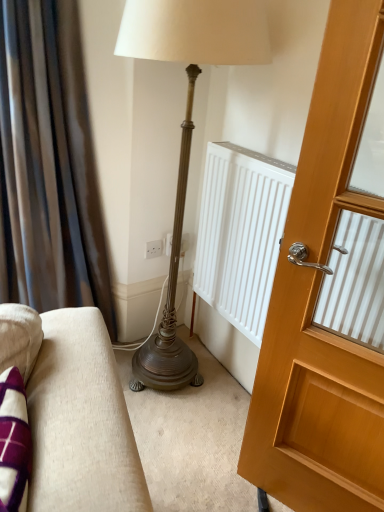
Question: Does wooden door at right turn towards brown velvet curtain at left?

Choices:
 (A) no
 (B) yes

Answer: (A)

Question: From the image's perspective, is wooden door at right under brown velvet curtain at left?

Choices:
 (A) yes
 (B) no

Answer: (A)

Question: Is wooden door at right oriented away from brown velvet curtain at left?

Choices:
 (A) yes
 (B) no

Answer: (B)

Question: Is wooden door at right positioned before brown velvet curtain at left?

Choices:
 (A) yes
 (B) no

Answer: (A)

Question: From a real-world perspective, is wooden door at right physically below brown velvet curtain at left?

Choices:
 (A) yes
 (B) no

Answer: (A)

Question: Can you confirm if wooden door at right is bigger than brown velvet curtain at left?

Choices:
 (A) yes
 (B) no

Answer: (B)

Question: Does brown velvet curtain at left come behind wooden door at right?

Choices:
 (A) no
 (B) yes

Answer: (B)

Question: Is brown velvet curtain at left in front of wooden door at right?

Choices:
 (A) yes
 (B) no

Answer: (B)

Question: Is wooden door at right surrounded by brown velvet curtain at left?

Choices:
 (A) yes
 (B) no

Answer: (B)

Question: Considering the relative sizes of brown velvet curtain at left and wooden door at right in the image provided, is brown velvet curtain at left taller than wooden door at right?

Choices:
 (A) no
 (B) yes

Answer: (B)

Question: Is wooden door at right at the back of brown velvet curtain at left?

Choices:
 (A) no
 (B) yes

Answer: (A)

Question: Considering the relative sizes of brown velvet curtain at left and wooden door at right in the image provided, is brown velvet curtain at left bigger than wooden door at right?

Choices:
 (A) yes
 (B) no

Answer: (A)

Question: In the image, is brown velvet curtain at left on the left side or the right side of wooden door at right?

Choices:
 (A) right
 (B) left

Answer: (B)